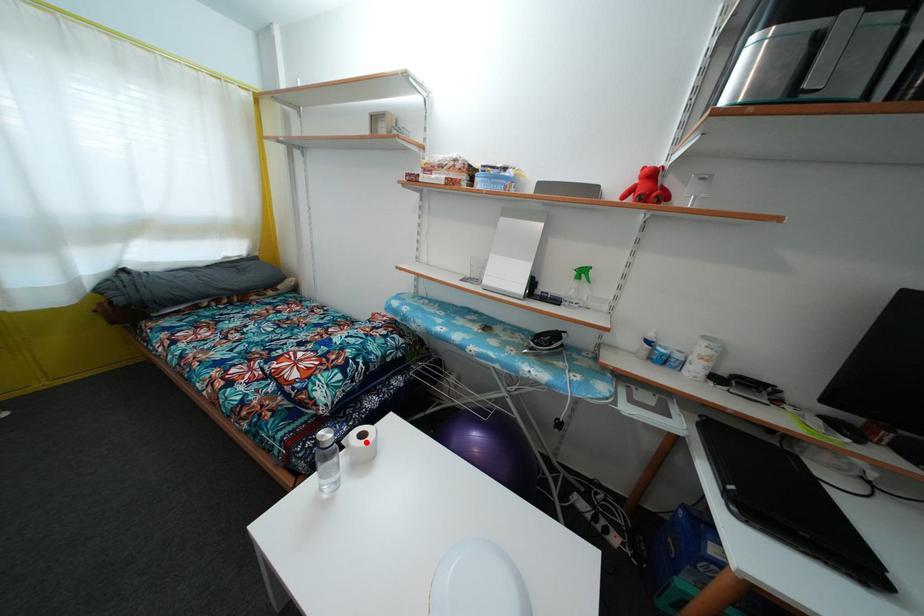
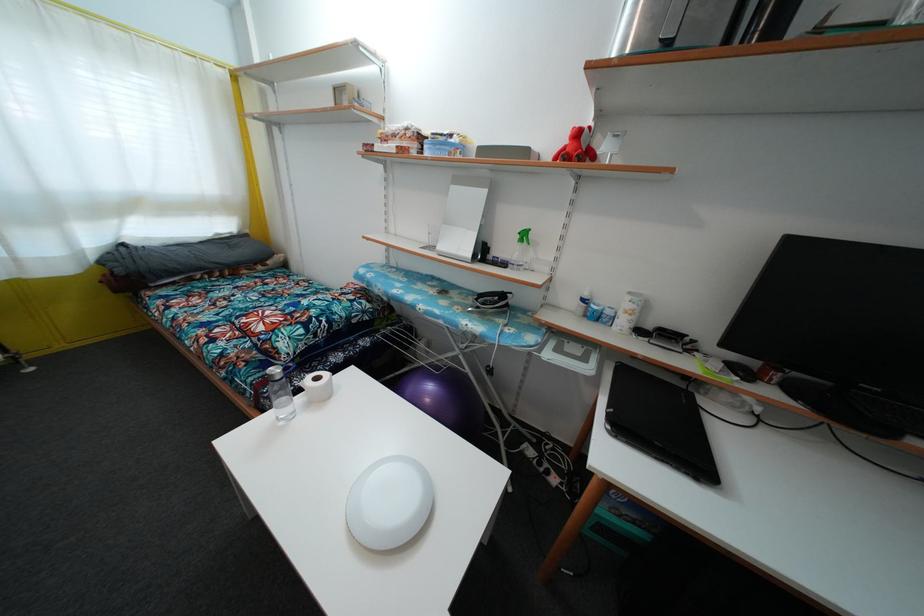
In the second image, find the point that corresponds to the highlighted location in the first image.

(321, 386)